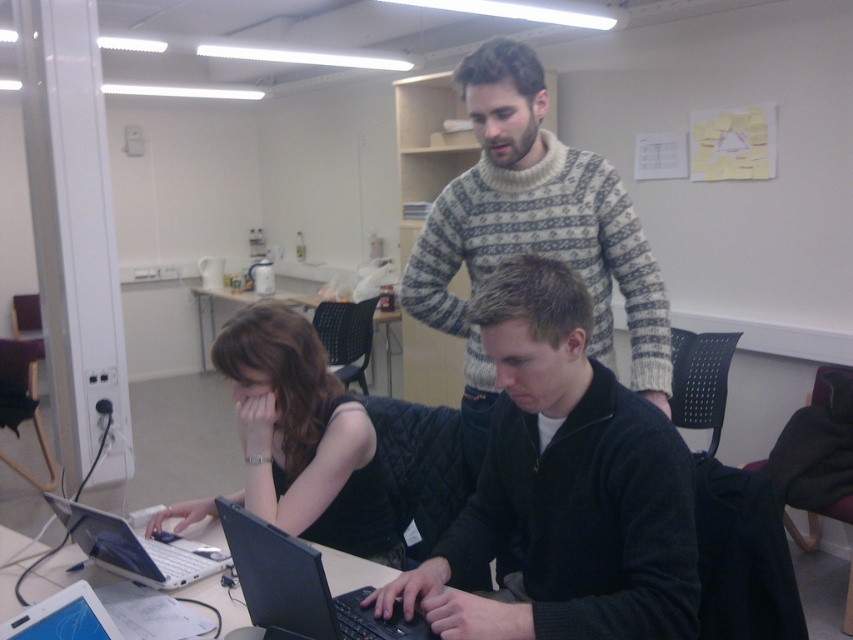
You are organizing a small event and need to place a 10cm tall decoration on either the white knitted sweater at center or the matte black tablet at lower left. Based on their heights, which object can safely support the decoration without it toppling over?

The white knitted sweater at center is taller than the matte black tablet at lower left, so it can safely support the decoration without it toppling over.

You are a photographer standing at the camera position. You want to take a photo of the black matte sweater at center. What is the minimum distance you need to move forward to ensure the sweater is the closest object in the photo?

The black matte sweater at center is 1.11 meters from the camera. To ensure it is the closest object in the photo, you don not need to move forward at all. The sweater is already the closest object at 1.11 meters.